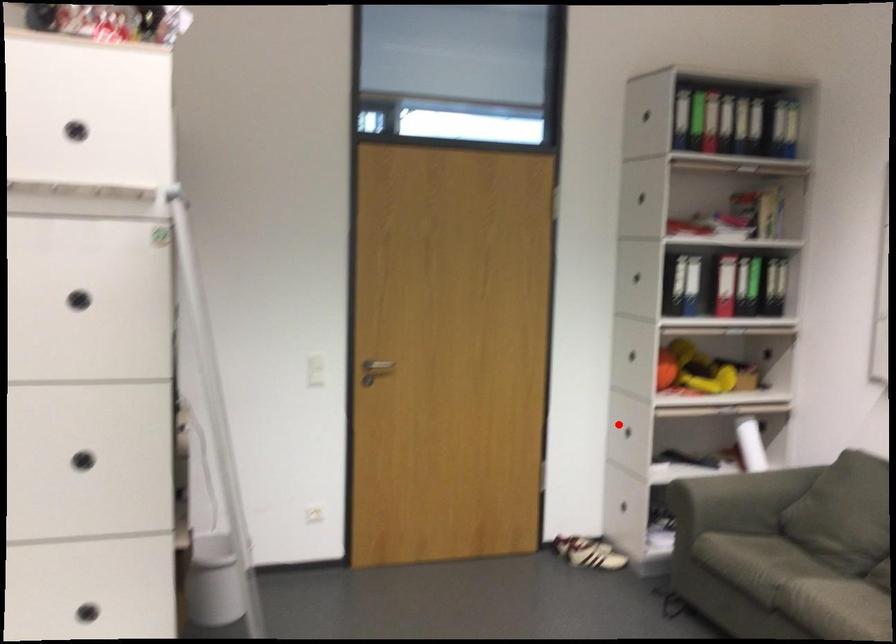
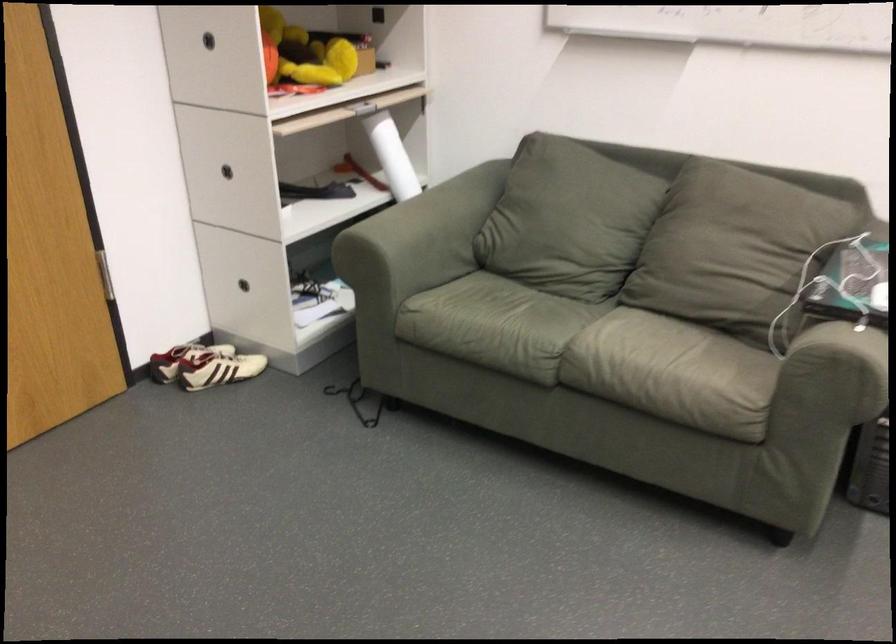
Locate, in the second image, the point that corresponds to the highlighted location in the first image.

(227, 171)